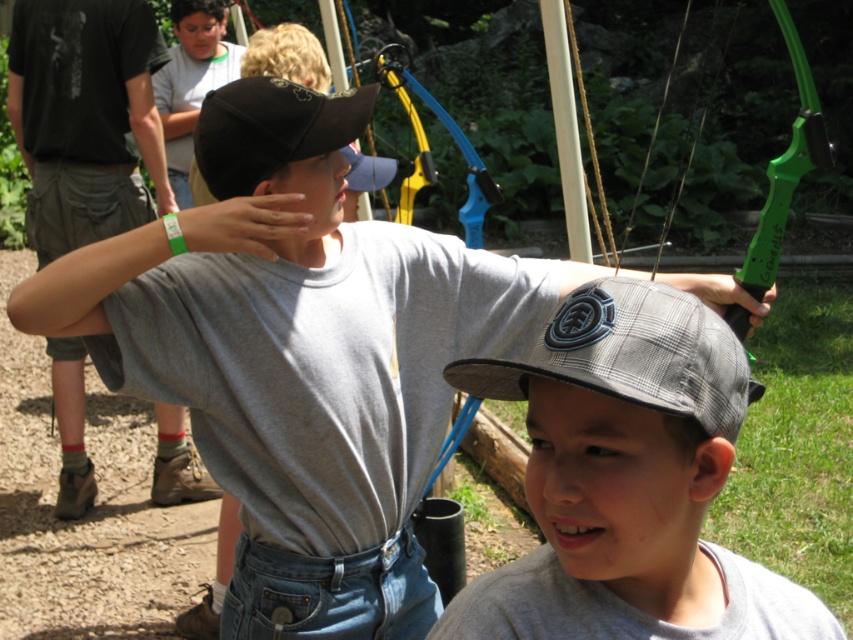
Question: Which point is closer to the camera taking this photo?

Choices:
 (A) (471, 384)
 (B) (322, 100)
 (C) (517, 380)

Answer: (C)

Question: Among these objects, which one is farthest from the camera?

Choices:
 (A) black matte baseball cap at upper center
 (B) gray checkered cap at center

Answer: (A)

Question: Which of the following is the closest to the observer?

Choices:
 (A) (210, 140)
 (B) (688, 387)

Answer: (B)

Question: Where is plaid fabric baseball cap at center located in relation to black matte baseball cap at upper center in the image?

Choices:
 (A) left
 (B) right

Answer: (B)

Question: Does plaid fabric baseball cap at center lie behind black matte baseball cap at upper center?

Choices:
 (A) no
 (B) yes

Answer: (A)

Question: Can you confirm if plaid fabric baseball cap at center is positioned to the right of black matte baseball cap at upper center?

Choices:
 (A) no
 (B) yes

Answer: (B)